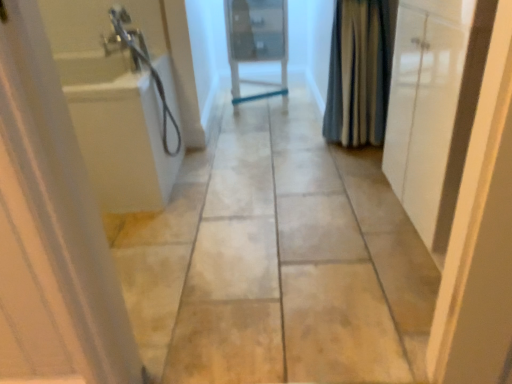
Question: Could you tell me if white glossy door at left, which is the first door in left-to-right order, is turned towards white glossy door at center, placed as the second door when sorted from right to left?

Choices:
 (A) yes
 (B) no

Answer: (B)

Question: From the image's perspective, would you say white glossy door at left, which is the first door in left-to-right order, is positioned over white glossy door at center, the 1th door from the back?

Choices:
 (A) no
 (B) yes

Answer: (A)

Question: From the image's perspective, does white glossy door at left, marked as the 3th door in a back-to-front arrangement, appear lower than white glossy door at center, the second door from the left?

Choices:
 (A) no
 (B) yes

Answer: (B)

Question: Considering the relative positions of white glossy door at left, marked as the 3th door in a back-to-front arrangement, and white glossy door at center, the 1th door from the back, in the image provided, is white glossy door at left, marked as the 3th door in a back-to-front arrangement, to the left of white glossy door at center, the 1th door from the back, from the viewer's perspective?

Choices:
 (A) yes
 (B) no

Answer: (A)

Question: From a real-world perspective, does white glossy door at left, which ranks as the 3th door in right-to-left order, stand above white glossy door at center, placed as the second door when sorted from right to left?

Choices:
 (A) yes
 (B) no

Answer: (A)

Question: Would you say beige tile floor at center is to the left or to the right of white glossy door at center, the 1th door from the back, in the picture?

Choices:
 (A) right
 (B) left

Answer: (B)

Question: Choose the correct answer: Is beige tile floor at center inside white glossy door at center, the third door when ordered from front to back, or outside it?

Choices:
 (A) outside
 (B) inside

Answer: (A)

Question: Considering their positions, is beige tile floor at center located in front of or behind white glossy door at center, the second door from the left?

Choices:
 (A) front
 (B) behind

Answer: (A)

Question: Considering the positions of beige tile floor at center and white glossy door at center, the third door when ordered from front to back, in the image, is beige tile floor at center wider or thinner than white glossy door at center, the third door when ordered from front to back,?

Choices:
 (A) wide
 (B) thin

Answer: (A)

Question: Is white glossy cabinet at right, which is the 1th door from right to left, in front of or behind blue striped fabric at right in the image?

Choices:
 (A) behind
 (B) front

Answer: (B)

Question: From a real-world perspective, is white glossy cabinet at right, marked as the second door in a front-to-back arrangement, above or below blue striped fabric at right?

Choices:
 (A) below
 (B) above

Answer: (A)

Question: Based on their sizes in the image, would you say white glossy cabinet at right, arranged as the second door when viewed from the back, is bigger or smaller than blue striped fabric at right?

Choices:
 (A) small
 (B) big

Answer: (B)

Question: From the image's perspective, is white glossy cabinet at right, arranged as the second door when viewed from the back, positioned above or below blue striped fabric at right?

Choices:
 (A) below
 (B) above

Answer: (A)

Question: Relative to white glossy door at left, which is counted as the first door, starting from the front, is blue striped fabric at right in front or behind?

Choices:
 (A) behind
 (B) front

Answer: (A)

Question: Considering the positions of blue striped fabric at right and white glossy door at left, which is counted as the first door, starting from the front, in the image, is blue striped fabric at right wider or thinner than white glossy door at left, which is counted as the first door, starting from the front,?

Choices:
 (A) wide
 (B) thin

Answer: (B)